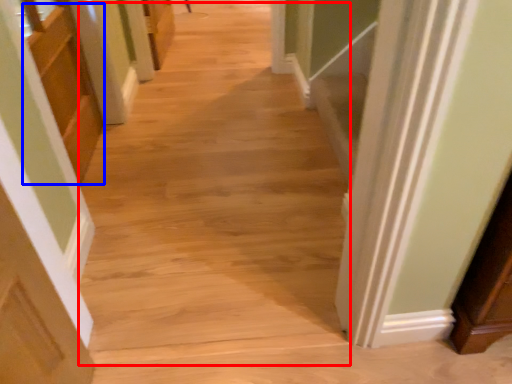
Question: Which object appears closest to the camera in this image, aisle (highlighted by a red box) or cabinetry (highlighted by a blue box)?

Choices:
 (A) aisle
 (B) cabinetry

Answer: (A)